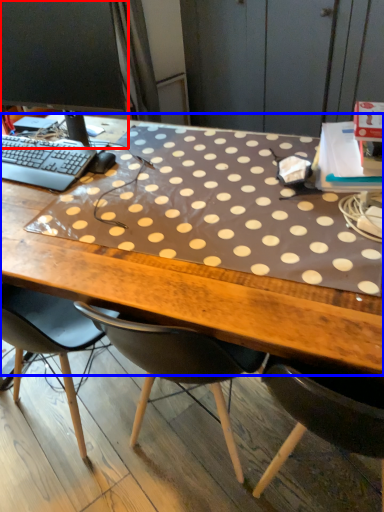
Question: Which point is closer to the camera, computer monitor (highlighted by a red box) or desk (highlighted by a blue box)?

Choices:
 (A) computer monitor
 (B) desk

Answer: (B)